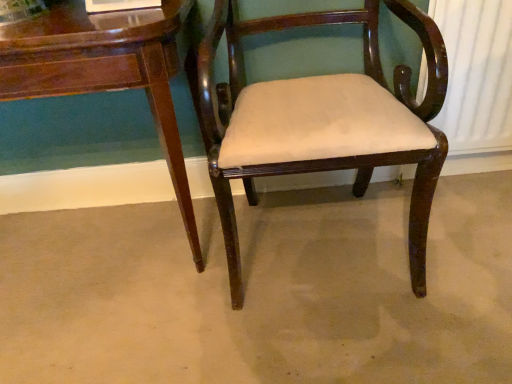
You are a GUI agent. You are given a task and a screenshot of the screen. Output one action in this format:
    pyautogui.click(x=<x>, y=<y>)
    Task: Click on the free space on the front side of mahogany wood chair at center
    
    Given the screenshot: What is the action you would take?
    pyautogui.click(x=337, y=339)